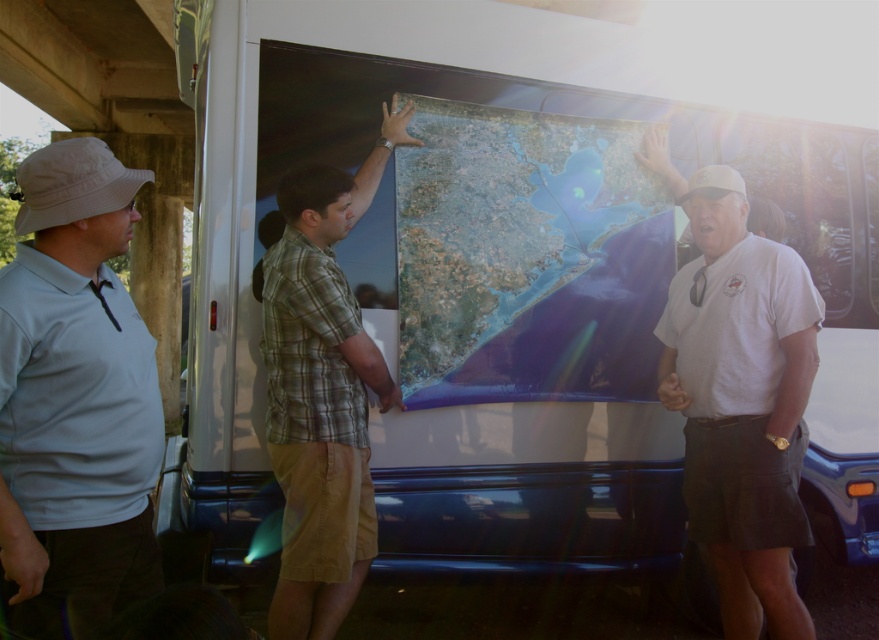
Can you confirm if satiny blue map at center is shorter than green plaid shirt at center?

Correct, satiny blue map at center is not as tall as green plaid shirt at center.

Who is shorter, satiny blue map at center or green plaid shirt at center?

satiny blue map at center is shorter.

The image size is (879, 640). Find the location of `satiny blue map at center`. satiny blue map at center is located at coordinates [527, 259].

Consider the image. Does white matte hat at upper left appear on the right side of white cotton shirt at center?

No, white matte hat at upper left is not to the right of white cotton shirt at center.

Who is more forward, (102,273) or (716,308)?

Point (102,273)

Who is more distant from viewer, (46,564) or (793,356)?

The point (793,356) is more distant.

Locate an element on the screen. Image resolution: width=879 pixels, height=640 pixels. white matte hat at upper left is located at coordinates (75, 400).

Consider the image. Between satiny blue map at center and white matte hat at upper left, which one is positioned higher?

satiny blue map at center

Between satiny blue map at center and white matte hat at upper left, which one has less height?

satiny blue map at center is shorter.

Find the location of a particular element. satiny blue map at center is located at coordinates (527, 259).